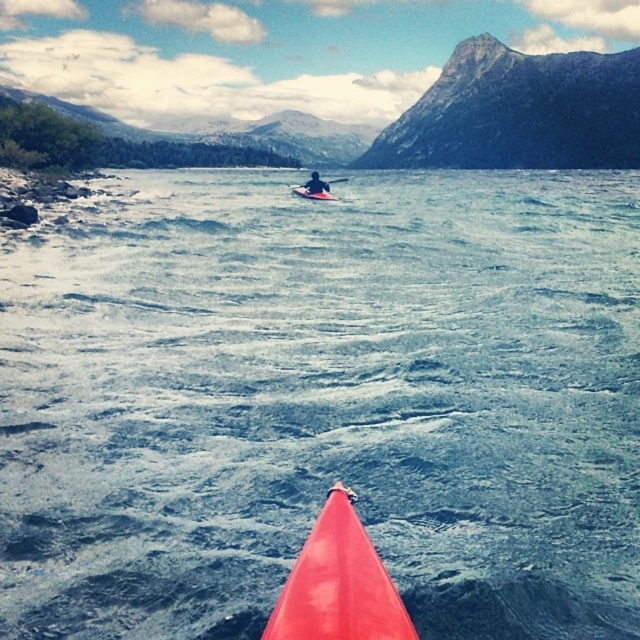
You are in a kayak and want to navigate between two points marked on your map. The first point is at coordinates point (292, 188) and the second is at point (344, 177). Based on the scene, which point is closer to your current position in the kayak?

Point (292, 188) is in front of point (344, 177), so it is closer to your current position in the kayak.

You are a photographer trying to capture the shiny red kayak at center in your shot. You notice the blue water at center is reflecting the kayak. Which object is wider in the image?

The blue water at center is wider than the shiny red kayak at center according to the description.